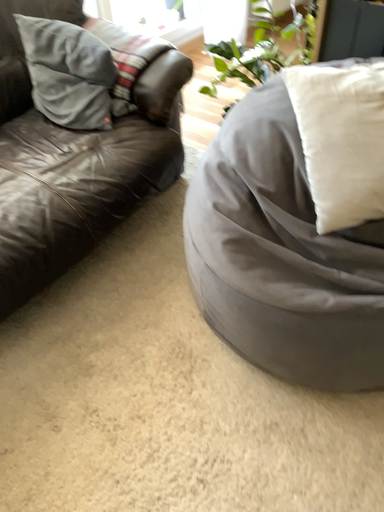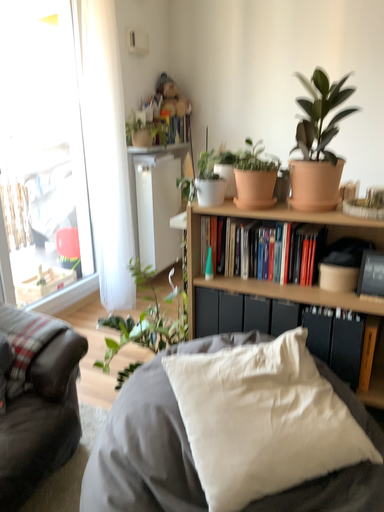
Question: How did the camera likely rotate when shooting the video?

Choices:
 (A) rotated right
 (B) rotated left

Answer: (A)